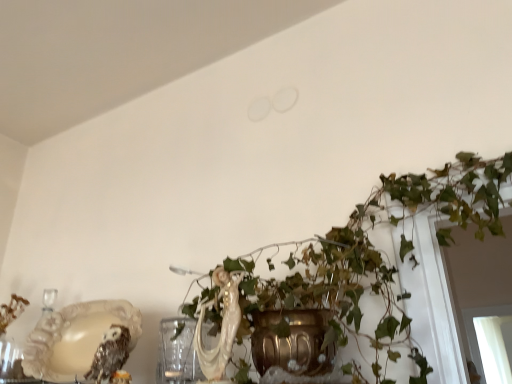
Question: Considering the relative sizes of green leafy plant at center and white glossy cat at center in the image provided, is green leafy plant at center bigger than white glossy cat at center?

Choices:
 (A) no
 (B) yes

Answer: (B)

Question: Does green leafy plant at center appear on the right side of white glossy cat at center?

Choices:
 (A) yes
 (B) no

Answer: (A)

Question: From a real-world perspective, is green leafy plant at center located higher than white glossy cat at center?

Choices:
 (A) yes
 (B) no

Answer: (A)

Question: Does green leafy plant at center turn towards white glossy cat at center?

Choices:
 (A) no
 (B) yes

Answer: (B)

Question: From a real-world perspective, is green leafy plant at center under white glossy cat at center?

Choices:
 (A) no
 (B) yes

Answer: (A)

Question: From the image's perspective, is shiny metallic owl at lower left above or below green leafy plant at center?

Choices:
 (A) above
 (B) below

Answer: (B)

Question: Looking at the image, does shiny metallic owl at lower left seem bigger or smaller compared to green leafy plant at center?

Choices:
 (A) big
 (B) small

Answer: (B)

Question: Is point (111, 374) positioned closer to the camera than point (284, 294)?

Choices:
 (A) closer
 (B) farther

Answer: (A)

Question: Is shiny metallic owl at lower left to the left or to the right of green leafy plant at center in the image?

Choices:
 (A) right
 (B) left

Answer: (B)

Question: From a real-world perspective, is green leafy plant at center above or below shiny metallic owl at lower left?

Choices:
 (A) above
 (B) below

Answer: (A)

Question: Choose the correct answer: Is green leafy plant at center inside shiny metallic owl at lower left or outside it?

Choices:
 (A) outside
 (B) inside

Answer: (A)

Question: From the image's perspective, is green leafy plant at center positioned above or below shiny metallic owl at lower left?

Choices:
 (A) above
 (B) below

Answer: (A)

Question: In terms of height, does green leafy plant at center look taller or shorter compared to shiny metallic owl at lower left?

Choices:
 (A) tall
 (B) short

Answer: (A)

Question: Is white glossy cat at center to the left or to the right of shiny metallic owl at lower left in the image?

Choices:
 (A) left
 (B) right

Answer: (B)

Question: In terms of size, does white glossy cat at center appear bigger or smaller than shiny metallic owl at lower left?

Choices:
 (A) small
 (B) big

Answer: (B)